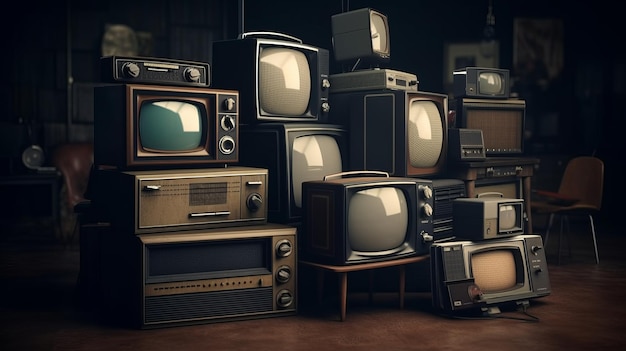
Identify the location of television screens. The height and width of the screenshot is (351, 626). (178, 129), (310, 159), (294, 93), (377, 34), (428, 128), (376, 217), (498, 266), (508, 213), (490, 83).